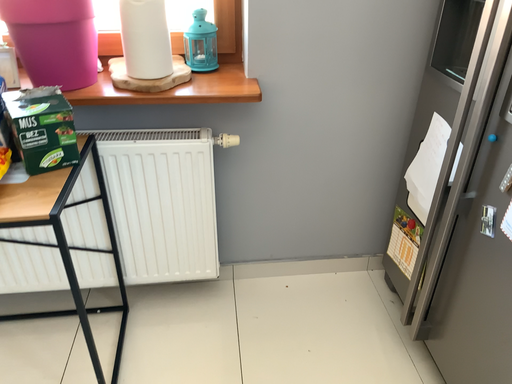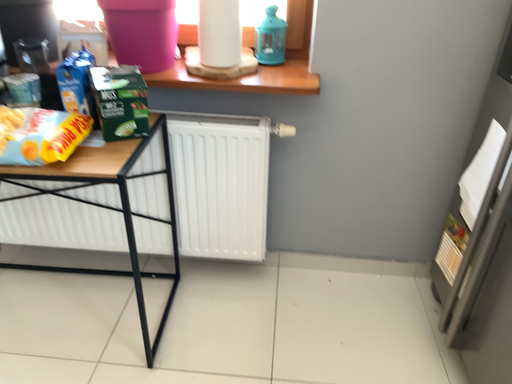
Question: How did the camera likely rotate when shooting the video?

Choices:
 (A) rotated right
 (B) rotated left

Answer: (B)